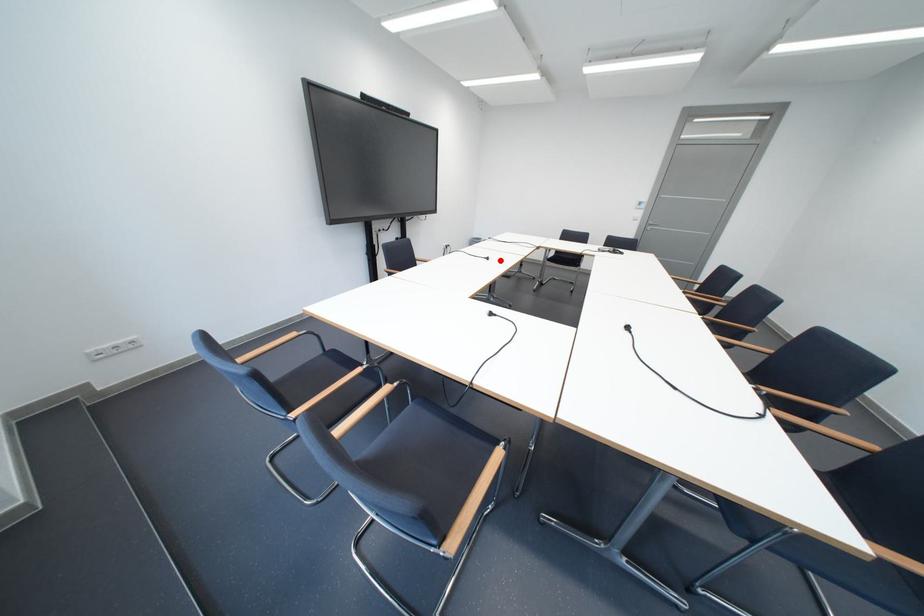
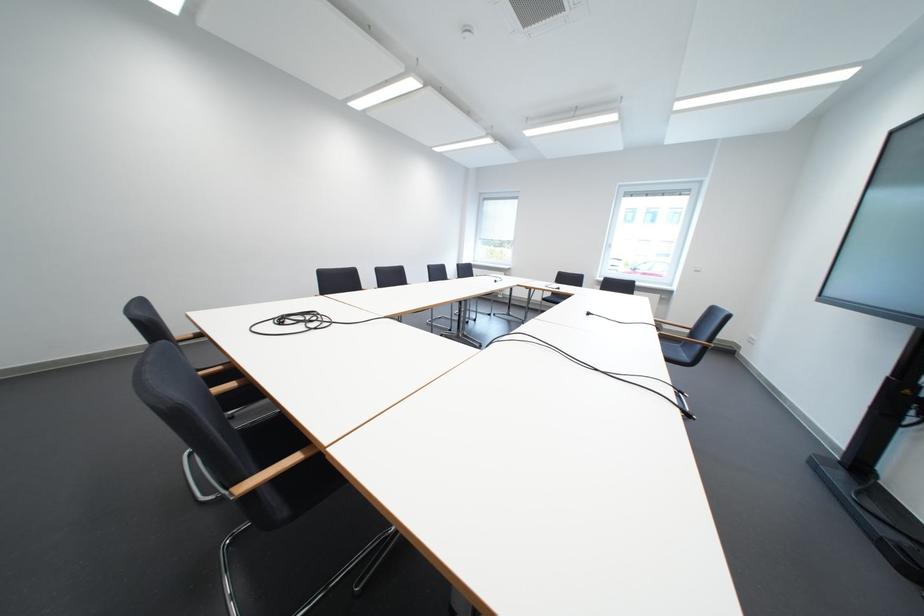
The point at the highlighted location is marked in the first image. Where is the corresponding point in the second image?

(601, 315)